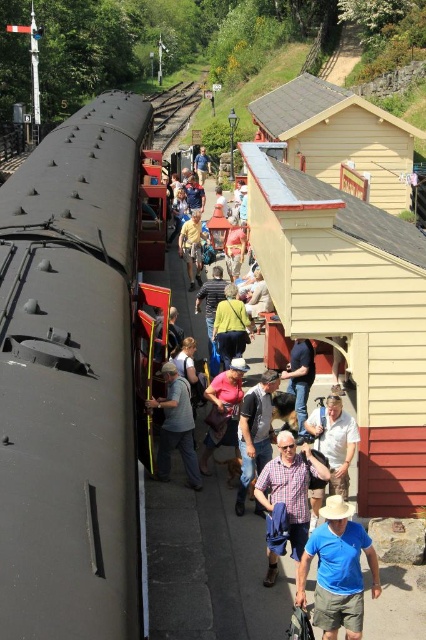
Question: Is matte black train at center above light brown leather jacket at center?

Choices:
 (A) no
 (B) yes

Answer: (A)

Question: Which point appears closest to the camera in this image?

Choices:
 (A) (164, 438)
 (B) (187, 321)
 (C) (100, 476)

Answer: (C)

Question: Can you confirm if blue cotton shirt at center is positioned above light brown leather jacket at center?

Choices:
 (A) no
 (B) yes

Answer: (A)

Question: Can you confirm if matte black train at center is smaller than blue cotton shirt at center?

Choices:
 (A) no
 (B) yes

Answer: (A)

Question: Based on their relative distances, which object is nearer to the brown wooden train track at upper center?

Choices:
 (A) blue cotton shirt at center
 (B) light brown leather jacket at center

Answer: (B)

Question: Among these points, which one is farthest from the camera?

Choices:
 (A) (31, 252)
 (B) (163, 90)
 (C) (305, 566)

Answer: (B)